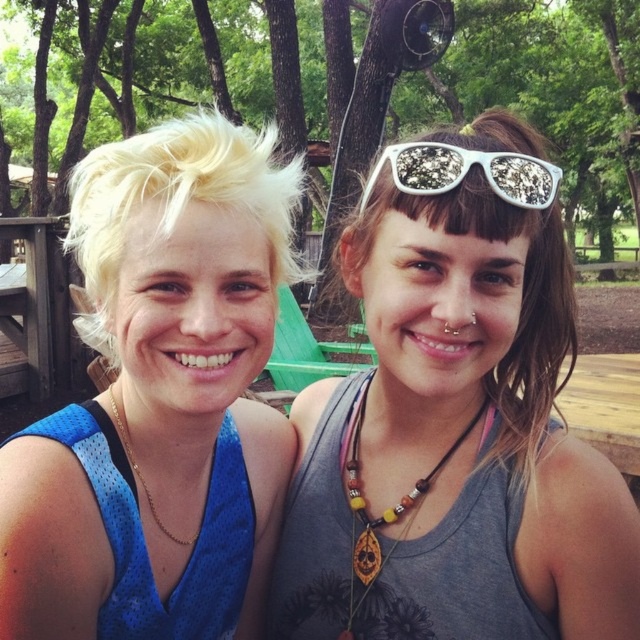
Question: Which object appears closest to the camera in this image?

Choices:
 (A) wooden picnic table at left
 (B) blonde hair at left
 (C) wooden bead necklace at center

Answer: (B)

Question: Can you confirm if blonde hair at left is bigger than white glittery sunglasses at upper center?

Choices:
 (A) no
 (B) yes

Answer: (B)

Question: Estimate the real-world distances between objects in this image. Which object is closer to the white glittery sunglasses at upper center?

Choices:
 (A) gray fabric tank top at center
 (B) gold chain necklace at left

Answer: (A)

Question: Can you confirm if gray fabric tank top at center is positioned to the right of wooden picnic table at left?

Choices:
 (A) yes
 (B) no

Answer: (A)

Question: Can you confirm if blonde hair at left is positioned above wooden picnic table at left?

Choices:
 (A) yes
 (B) no

Answer: (B)

Question: Which point appears farthest from the camera in this image?

Choices:
 (A) (243, 294)
 (B) (198, 520)

Answer: (B)